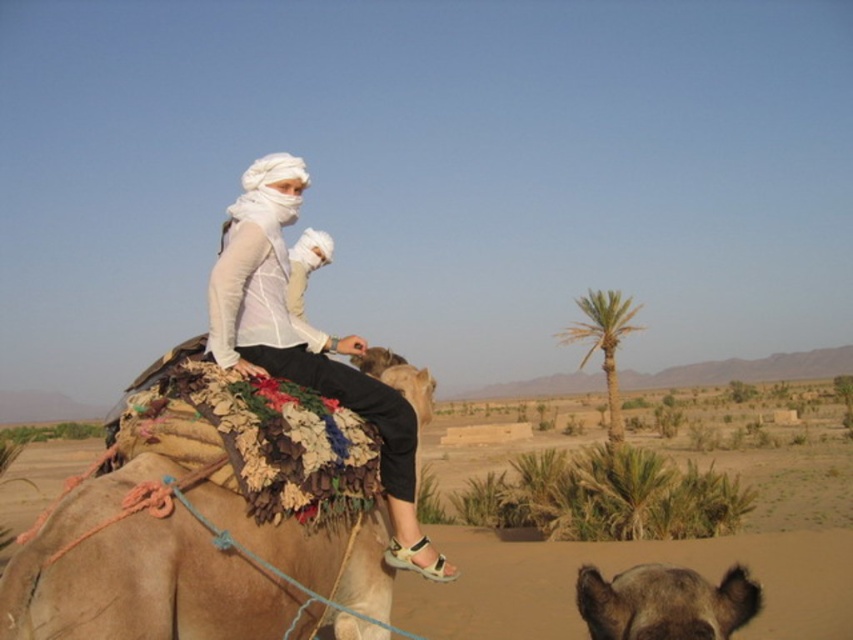
Question: Which of these objects is positioned farthest from the brown fuzzy camel at center?

Choices:
 (A) brown textured camel at center
 (B) white matte clothing at center
 (C) beige textured saddle at center
 (D) green leafy palm at center

Answer: (D)

Question: Does beige textured saddle at center have a larger size compared to white matte clothing at center?

Choices:
 (A) no
 (B) yes

Answer: (A)

Question: Which object is farther from the camera taking this photo?

Choices:
 (A) white matte clothing at center
 (B) brown textured camel at center

Answer: (A)

Question: Which object is closer to the camera taking this photo?

Choices:
 (A) green leafy palm at center
 (B) beige textured saddle at center
 (C) white matte clothing at center

Answer: (B)

Question: Does beige textured saddle at center lie in front of green leafy palm at center?

Choices:
 (A) yes
 (B) no

Answer: (A)

Question: Does brown textured camel at center have a smaller size compared to brown fuzzy camel at center?

Choices:
 (A) yes
 (B) no

Answer: (B)